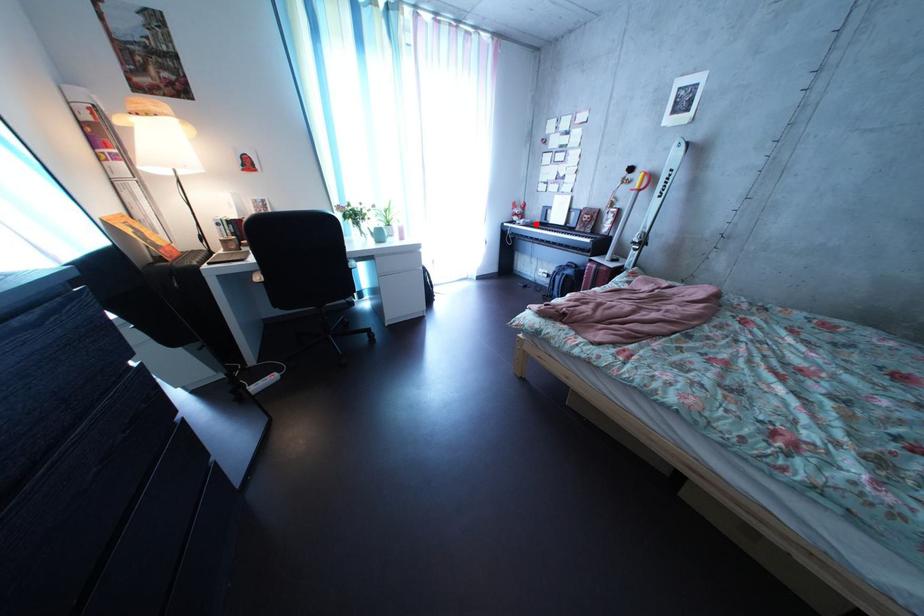
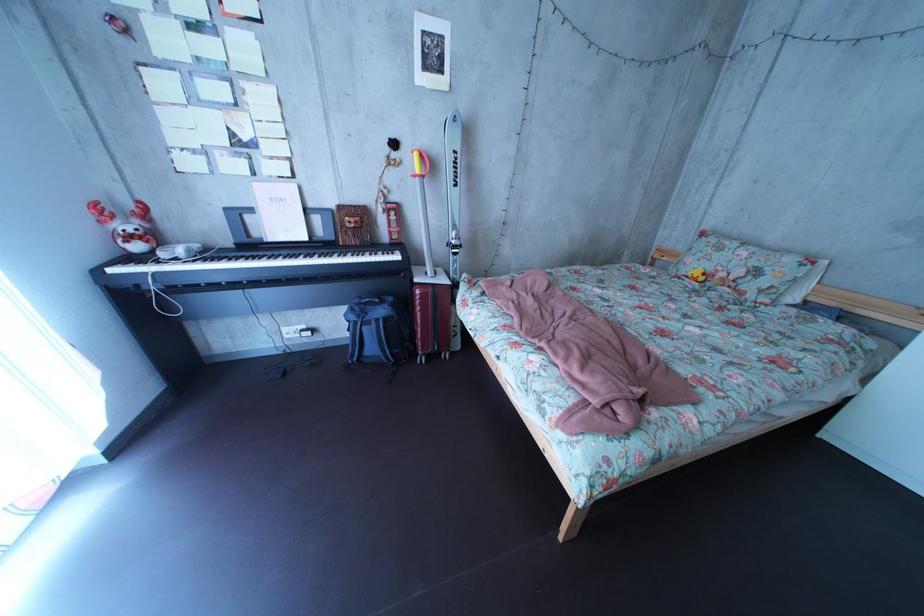
Question: I am providing you with two images of the same scene from different viewpoints. In image1, a red point is highlighted. Considering the same 3D point in image2, which of the following is correct?

Choices:
 (A) It is closer
 (B) It is farther

Answer: (B)